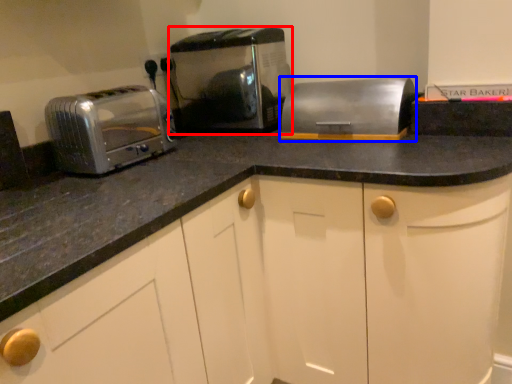
Question: Which of the following is the farthest to the observer, toaster (highlighted by a red box) or appliance (highlighted by a blue box)?

Choices:
 (A) toaster
 (B) appliance

Answer: (A)